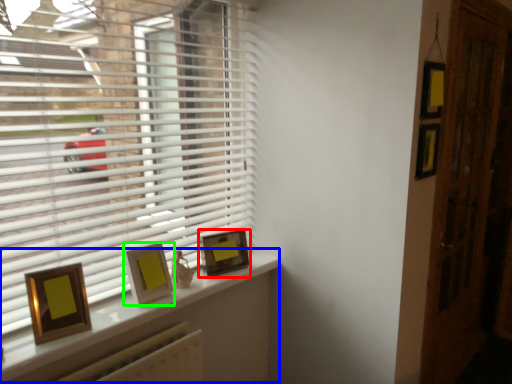
Question: Based on their relative distances, which object is farther from picture frame (highlighted by a red box)? Choose from window (highlighted by a blue box) and picture frame (highlighted by a green box).

Choices:
 (A) window
 (B) picture frame

Answer: (B)